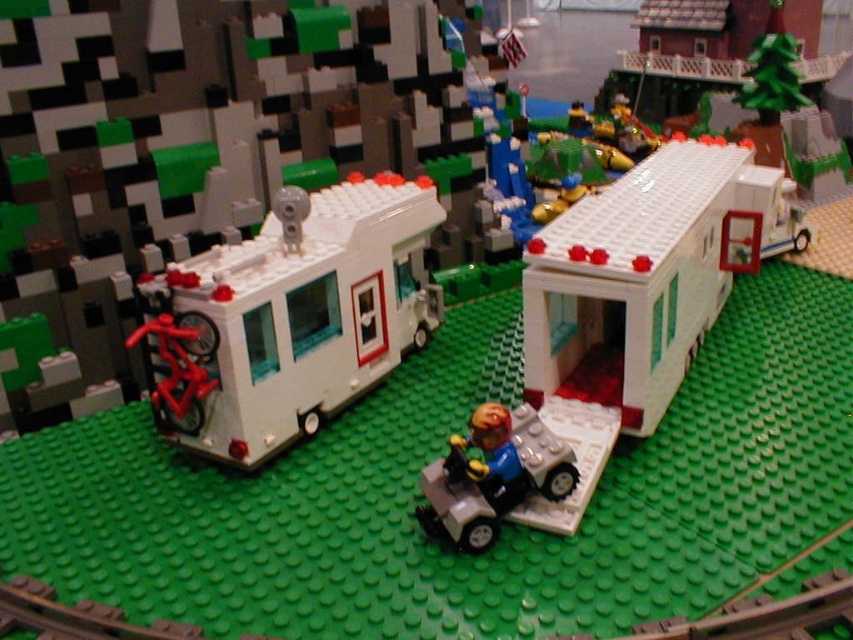
Can you confirm if white plastic camper at left is shorter than light gray plastic car at center?

In fact, white plastic camper at left may be taller than light gray plastic car at center.

Is white plastic camper at left taller than light gray plastic car at center?

Yes.

Does point (248, 410) come behind point (531, 456)?

That is True.

Image resolution: width=853 pixels, height=640 pixels. In order to click on white plastic camper at left in this screenshot , I will do `click(289, 316)`.